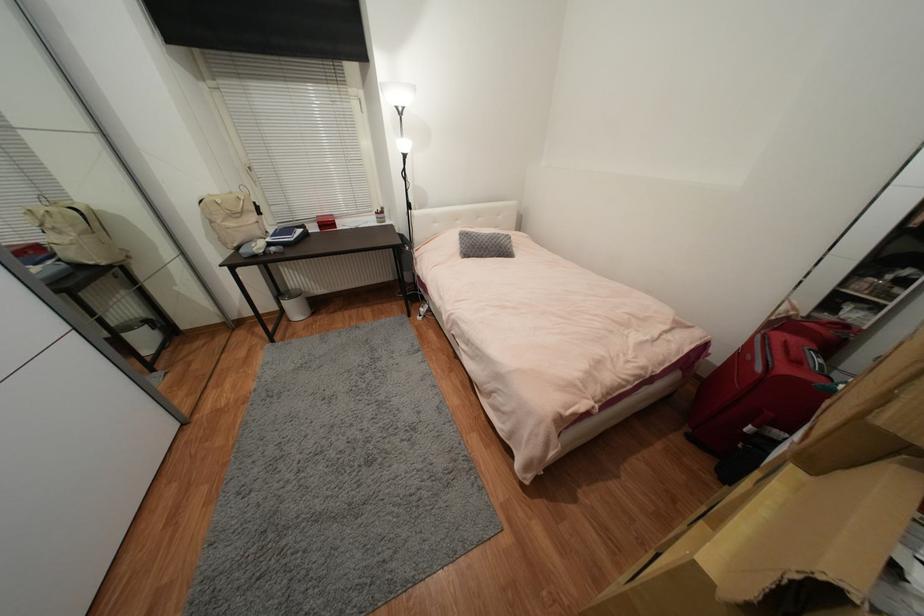
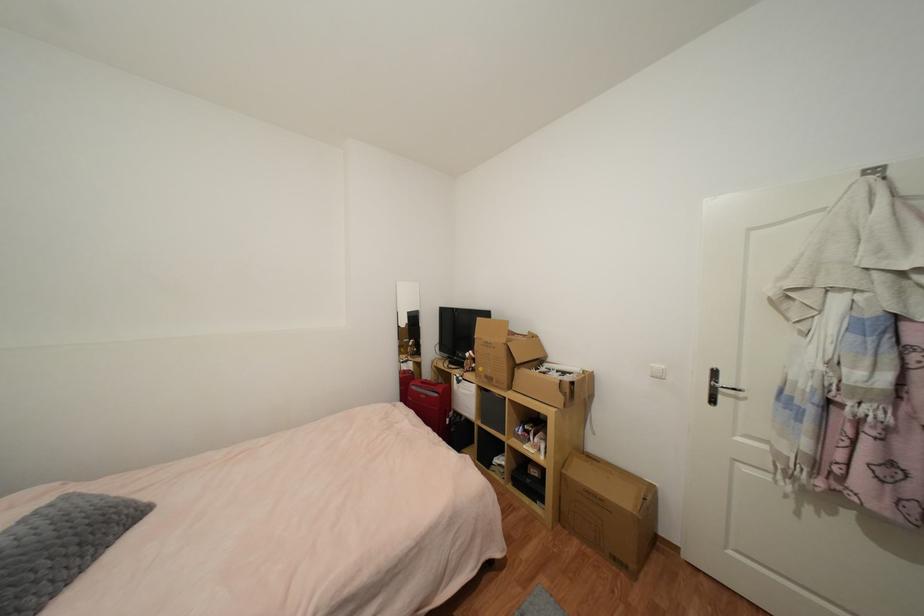
Locate, in the second image, the point that corresponds to [763,371] in the first image.

(440, 397)